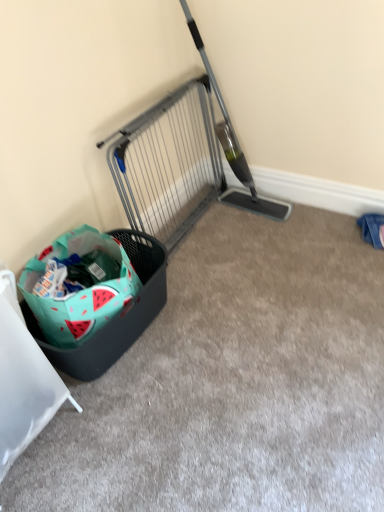
Question: Would you say watermelon-patterned fabric shopping bag at lower left is part of metallic gray gate at upper center's contents?

Choices:
 (A) yes
 (B) no

Answer: (B)

Question: Is metallic gray gate at upper center not near watermelon-patterned fabric shopping bag at lower left?

Choices:
 (A) yes
 (B) no

Answer: (B)

Question: Is metallic gray gate at upper center to the left of watermelon-patterned fabric shopping bag at lower left from the viewer's perspective?

Choices:
 (A) yes
 (B) no

Answer: (B)

Question: From a real-world perspective, is metallic gray gate at upper center on top of watermelon-patterned fabric shopping bag at lower left?

Choices:
 (A) yes
 (B) no

Answer: (A)

Question: From a real-world perspective, is metallic gray gate at upper center beneath watermelon-patterned fabric shopping bag at lower left?

Choices:
 (A) no
 (B) yes

Answer: (A)

Question: From the image's perspective, would you say metallic gray gate at upper center is positioned over watermelon-patterned fabric shopping bag at lower left?

Choices:
 (A) no
 (B) yes

Answer: (B)

Question: Is watermelon-patterned fabric shopping bag at lower left to the left of metallic gray gate at upper center from the viewer's perspective?

Choices:
 (A) no
 (B) yes

Answer: (B)

Question: From a real-world perspective, is watermelon-patterned fabric shopping bag at lower left beneath metallic gray gate at upper center?

Choices:
 (A) yes
 (B) no

Answer: (A)

Question: From the image's perspective, does watermelon-patterned fabric shopping bag at lower left appear higher than metallic gray gate at upper center?

Choices:
 (A) yes
 (B) no

Answer: (B)

Question: Is watermelon-patterned fabric shopping bag at lower left to the right of metallic gray gate at upper center from the viewer's perspective?

Choices:
 (A) yes
 (B) no

Answer: (B)

Question: From a real-world perspective, is watermelon-patterned fabric shopping bag at lower left on metallic gray gate at upper center?

Choices:
 (A) no
 (B) yes

Answer: (A)

Question: Considering the relative sizes of watermelon-patterned fabric shopping bag at lower left and metallic gray gate at upper center in the image provided, is watermelon-patterned fabric shopping bag at lower left smaller than metallic gray gate at upper center?

Choices:
 (A) no
 (B) yes

Answer: (B)

Question: Would you say teal fabric basket at lower left contains watermelon-patterned fabric shopping bag at lower left?

Choices:
 (A) no
 (B) yes

Answer: (A)